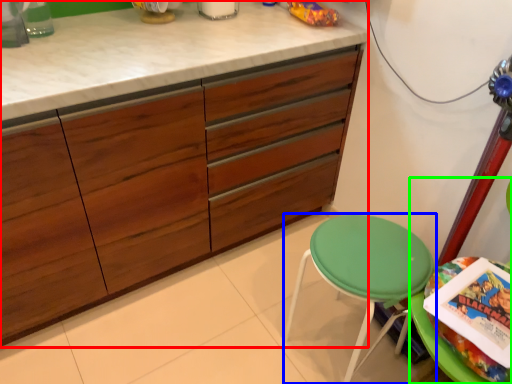
Question: Which is nearer to the cabinetry (highlighted by a red box)? stool (highlighted by a blue box) or swivel chair (highlighted by a green box).

Choices:
 (A) stool
 (B) swivel chair

Answer: (A)